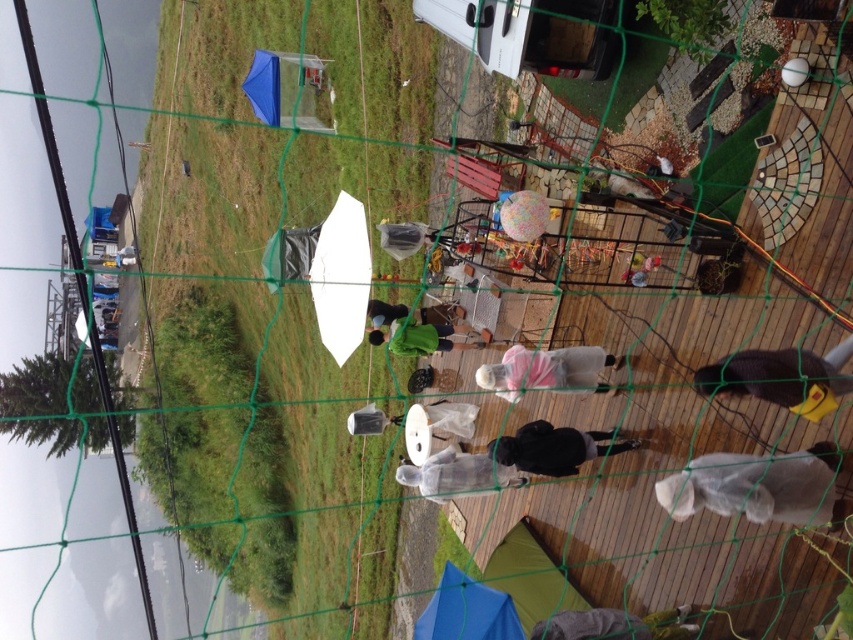
Between point (412, 333) and point (633, 285), which one is positioned in front?

Point (633, 285) is more forward.

Does point (432, 326) come closer to viewer compared to point (637, 280)?

No, it is not.

Who is more forward, (424, 337) or (640, 284)?

Point (640, 284) is in front.

I want to click on green matte jacket at center, so click(427, 337).

Which is in front, point (482, 372) or point (445, 340)?

Point (482, 372)

This screenshot has width=853, height=640. What do you see at coordinates (546, 371) in the screenshot?
I see `pink matte raincoat at center` at bounding box center [546, 371].

Find the location of `pink matte raincoat at center`. pink matte raincoat at center is located at coordinates (546, 371).

In the scene shown: Who is taller, matte black umbrella at center or light blue fabric at center?

Standing taller between the two is matte black umbrella at center.

Looking at this image, which is more to the left, matte black umbrella at center or light blue fabric at center?

Positioned to the left is matte black umbrella at center.

I want to click on matte black umbrella at center, so click(x=403, y=237).

The image size is (853, 640). Identify the location of matte black umbrella at center. (403, 237).